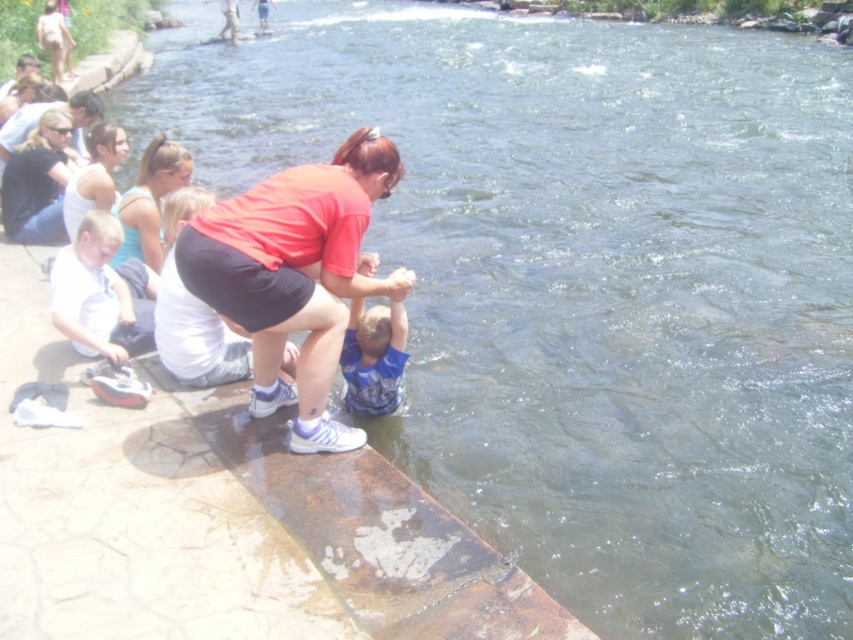
You are standing at the point labeled as point (160, 282) and want to throw a ball to someone exactly 10 feet away from you. Is there enough space between you and the viewer to make this throw?

The distance between point (160, 282) and the viewer is 15.45 feet, which is more than 10 feet, so there is enough space to throw the ball 10 feet from your position at point (160, 282).

You are standing at the point with coordinates point (64,284) and want to walk to point (171,237). Which direction should you move in to reach your destination?

You should move backward because point (64,284) is in front of point (171,237), so moving backward from point (64,284) will lead you toward point (171,237).

You are a photographer standing at the riverbank. You want to take a photo of the matte black shorts at center and the blue cotton shirt at center such that both are in focus. Given that your camera has a depth of field that can sharply focus objects within a 25 inch range, will both objects be in focus in the photo?

The matte black shorts at center and blue cotton shirt at center are 26.23 inches apart. Since the distance between them exceeds the camera lens depth of field range of 25 inches, at least one of the objects will be out of focus in the photo.